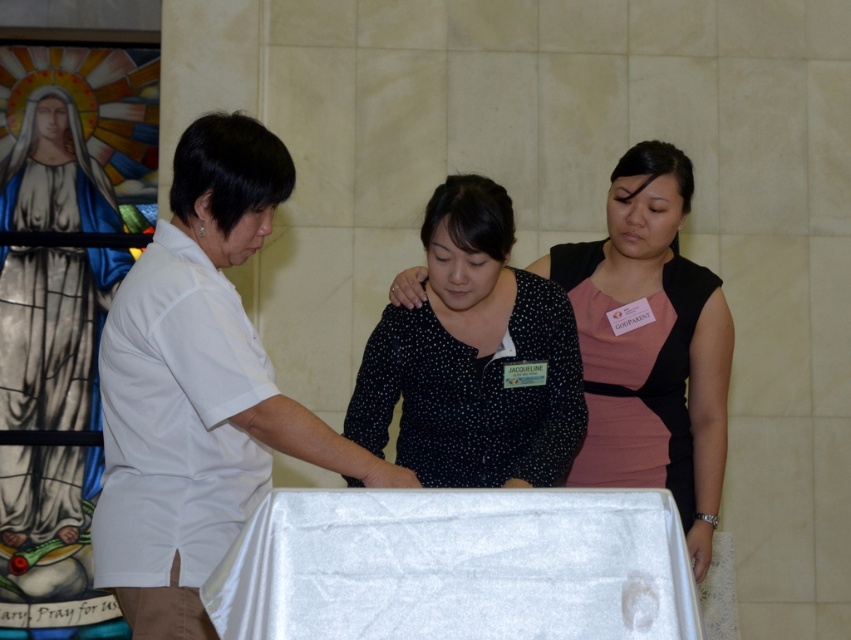
You are an interior designer planning to place a new chair that requires 1 meter of space between the white matte shirt at center and the white satin table at center. Based on the scene, can the chair be placed there?

The white matte shirt at center is narrower than the white satin table at center. However, the exact dimensions needed for the chair placement aren

You are an event photographer in a church. You need to capture a clear photo of both the white matte shirt at center and the black dotted blouse at center. However, the camera can only focus on one subject at a time. Which clothing item should you focus on first to ensure the other is still somewhat in focus?

The white matte shirt at center is positioned under the black dotted blouse at center. By focusing on the black dotted blouse at center first, the white matte shirt at center will still be somewhat in focus due to its proximity in depth.

You are an assistant helping to organize a fashion show. You have two items displayed at the center of the stage, a black dotted blouse at center and a black dotted dress at center. Which one is visible on top?

The black dotted blouse at center is visible on top because it is in front of the black dotted dress at center.